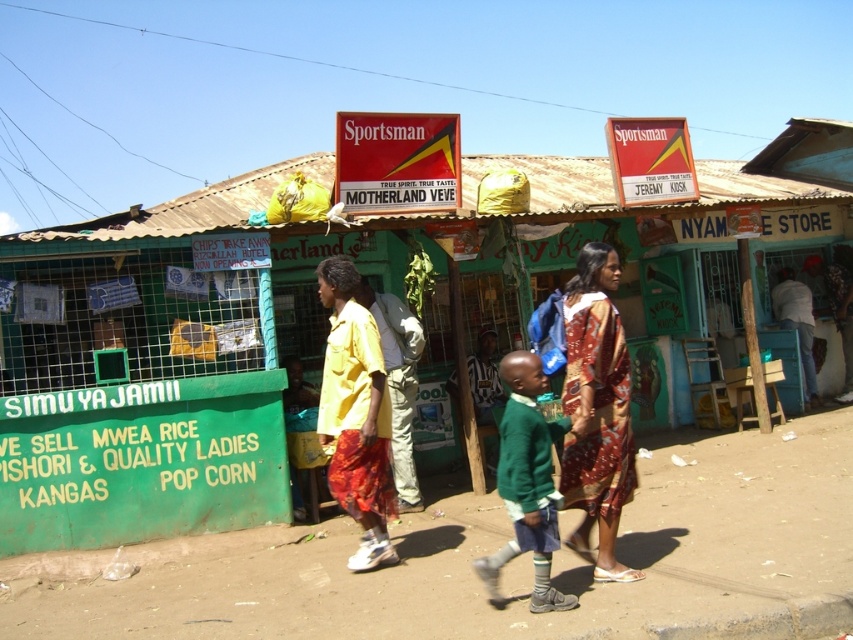
Question: Which of these objects is positioned closest to the printed silk dress at center?

Choices:
 (A) green knitted sweater at center
 (B) yellow fabric skirt at center

Answer: (A)

Question: Is printed silk dress at center behind green knitted sweater at center?

Choices:
 (A) yes
 (B) no

Answer: (A)

Question: Observing the image, what is the correct spatial positioning of yellow fabric skirt at center in reference to green knitted sweater at center?

Choices:
 (A) left
 (B) right

Answer: (A)

Question: Which object is positioned farthest from the yellow fabric skirt at center?

Choices:
 (A) green knitted sweater at center
 (B) printed silk dress at center

Answer: (B)

Question: Does yellow fabric skirt at center appear on the left side of green knitted sweater at center?

Choices:
 (A) yes
 (B) no

Answer: (A)

Question: Which point is farther to the camera?

Choices:
 (A) printed silk dress at center
 (B) yellow fabric skirt at center
 (C) green knitted sweater at center

Answer: (B)